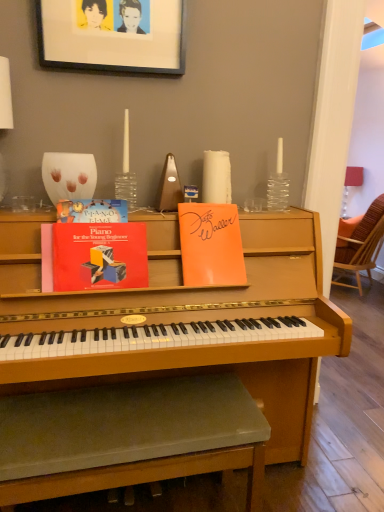
This screenshot has height=512, width=384. I want to click on orange paper at upper center, the 3th paperback book when ordered from left to right, so click(211, 245).

I want to click on matte red book at center, the 2th paperback book from the left, so click(x=99, y=256).

The image size is (384, 512). What do you see at coordinates (128, 437) in the screenshot?
I see `green fabric music stool at lower center` at bounding box center [128, 437].

Identify the location of wooden woven chair at right. The height and width of the screenshot is (512, 384). (361, 244).

What is the approximate width of black matte picture frame at upper center?

black matte picture frame at upper center is 3.58 inches wide.

The image size is (384, 512). I want to click on orange paper at upper center, the 3th paperback book when ordered from left to right, so click(211, 245).

How distant is hardcover book at upper left, acting as the 1th paperback book starting from the left, from wooden woven chair at right?

hardcover book at upper left, acting as the 1th paperback book starting from the left, and wooden woven chair at right are 10.01 feet apart from each other.

The width and height of the screenshot is (384, 512). Find the location of `paperback book above the wooden woven chair at right (from the image's perspective)`. paperback book above the wooden woven chair at right (from the image's perspective) is located at coordinates (92, 211).

Can we say hardcover book at upper left, acting as the 1th paperback book starting from the left, lies outside wooden woven chair at right?

Indeed, hardcover book at upper left, acting as the 1th paperback book starting from the left, is completely outside wooden woven chair at right.

Looking at the image, does hardcover book at upper left, which is counted as the third paperback book, starting from the right, seem bigger or smaller compared to wooden woven chair at right?

Clearly, hardcover book at upper left, which is counted as the third paperback book, starting from the right, is smaller in size than wooden woven chair at right.

From the image's perspective, is green fabric music stool at lower center below wooden woven chair at right?

Correct, green fabric music stool at lower center appears lower than wooden woven chair at right in the image.

Which object is positioned more to the right, green fabric music stool at lower center or wooden woven chair at right?

From the viewer's perspective, wooden woven chair at right appears more on the right side.

Does point (104, 421) appear closer or farther from the camera than point (370, 243)?

Point (104, 421) is closer to the camera than point (370, 243).

Is wooden woven chair at right located within green fabric music stool at lower center?

No, wooden woven chair at right is not surrounded by green fabric music stool at lower center.

Image resolution: width=384 pixels, height=512 pixels. There is a black matte picture frame at upper center. In order to click on the 3rd paperback book below it (from the image's perspective) in this screenshot , I will do (x=99, y=256).

Which is in front, point (163, 28) or point (115, 233)?

The point (115, 233) is closer.

Is black matte picture frame at upper center shorter than matte red book at center, arranged as the 2th paperback book when viewed from the right?

No, black matte picture frame at upper center is not shorter than matte red book at center, arranged as the 2th paperback book when viewed from the right.

Considering the sizes of black matte picture frame at upper center and matte red book at center, the 2th paperback book from the left, in the image, is black matte picture frame at upper center wider or thinner than matte red book at center, the 2th paperback book from the left,?

Considering their sizes, black matte picture frame at upper center looks slimmer than matte red book at center, the 2th paperback book from the left.

Consider the image. Is green fabric music stool at lower center a part of hardcover book at upper left, which is counted as the third paperback book, starting from the right?

No, green fabric music stool at lower center is not inside hardcover book at upper left, which is counted as the third paperback book, starting from the right.

Between hardcover book at upper left, which is counted as the third paperback book, starting from the right, and green fabric music stool at lower center, which one has more height?

green fabric music stool at lower center.

Considering the relative positions of hardcover book at upper left, acting as the 1th paperback book starting from the left, and green fabric music stool at lower center in the image provided, is hardcover book at upper left, acting as the 1th paperback book starting from the left, behind green fabric music stool at lower center?

Yes, hardcover book at upper left, acting as the 1th paperback book starting from the left, is further from the camera.

Locate an element on the screen. The width and height of the screenshot is (384, 512). music stool below the hardcover book at upper left, which is counted as the third paperback book, starting from the right (from a real-world perspective) is located at coordinates (128, 437).

Between orange paper at upper center, the 3th paperback book when ordered from left to right, and green fabric music stool at lower center, which one has smaller size?

orange paper at upper center, the 3th paperback book when ordered from left to right.

Is orange paper at upper center, the first paperback book when ordered from right to left, located outside green fabric music stool at lower center?

Yes, orange paper at upper center, the first paperback book when ordered from right to left, is located beyond the bounds of green fabric music stool at lower center.

From the image's perspective, which is below, orange paper at upper center, the first paperback book when ordered from right to left, or green fabric music stool at lower center?

green fabric music stool at lower center is shown below in the image.

Is orange paper at upper center, the first paperback book when ordered from right to left, facing towards green fabric music stool at lower center?

No, orange paper at upper center, the first paperback book when ordered from right to left, is not oriented towards green fabric music stool at lower center.

Which object is thinner, orange paper at upper center, the 3th paperback book when ordered from left to right, or matte red book at center, arranged as the 2th paperback book when viewed from the right?

matte red book at center, arranged as the 2th paperback book when viewed from the right, is thinner.

From a real-world perspective, is orange paper at upper center, the first paperback book when ordered from right to left, positioned under matte red book at center, the 2th paperback book from the left, based on gravity?

Actually, orange paper at upper center, the first paperback book when ordered from right to left, is physically above matte red book at center, the 2th paperback book from the left, in the real world.

Can you confirm if orange paper at upper center, the 3th paperback book when ordered from left to right, is bigger than matte red book at center, arranged as the 2th paperback book when viewed from the right?

Correct, orange paper at upper center, the 3th paperback book when ordered from left to right, is larger in size than matte red book at center, arranged as the 2th paperback book when viewed from the right.

Does orange paper at upper center, the 3th paperback book when ordered from left to right, lie in front of matte red book at center, arranged as the 2th paperback book when viewed from the right?

No, orange paper at upper center, the 3th paperback book when ordered from left to right, is further to the viewer.

From a real-world perspective, relative to wooden woven chair at right, is black matte picture frame at upper center vertically above or below?

From a real-world perspective, black matte picture frame at upper center is physically above wooden woven chair at right.

Does black matte picture frame at upper center have a greater height compared to wooden woven chair at right?

No.

From the image's perspective, is black matte picture frame at upper center above or below wooden woven chair at right?

black matte picture frame at upper center is situated higher than wooden woven chair at right in the image.

Which of these two, black matte picture frame at upper center or wooden woven chair at right, is thinner?

Thinner between the two is black matte picture frame at upper center.

You are a GUI agent. You are given a task and a screenshot of the screen. Output one action in this format:
    pyautogui.click(x=<x>, y=<y>)
    Task: Click on the paperback book located above the wooden woven chair at right (from the image's perspective)
    
    Given the screenshot: What is the action you would take?
    pyautogui.click(x=92, y=211)

Identify the location of music stool in front of the wooden woven chair at right. This screenshot has width=384, height=512. (128, 437).

Estimate the real-world distances between objects in this image. Which object is further from hardcover book at upper left, which is counted as the third paperback book, starting from the right, green fabric music stool at lower center or orange paper at upper center, the first paperback book when ordered from right to left?

The object further to hardcover book at upper left, which is counted as the third paperback book, starting from the right, is green fabric music stool at lower center.

Based on their spatial positions, is matte red book at center, the 2th paperback book from the left, or black matte picture frame at upper center further from orange paper at upper center, the first paperback book when ordered from right to left?

black matte picture frame at upper center lies further to orange paper at upper center, the first paperback book when ordered from right to left, than the other object.

Based on their spatial positions, is orange paper at upper center, the 3th paperback book when ordered from left to right, or hardcover book at upper left, which is counted as the third paperback book, starting from the right, further from wooden woven chair at right?

hardcover book at upper left, which is counted as the third paperback book, starting from the right, is positioned further to the anchor wooden woven chair at right.

Estimate the real-world distances between objects in this image. Which object is closer to wooden woven chair at right, matte red book at center, arranged as the 2th paperback book when viewed from the right, or hardcover book at upper left, acting as the 1th paperback book starting from the left?

Among the two, matte red book at center, arranged as the 2th paperback book when viewed from the right, is located nearer to wooden woven chair at right.

Looking at the image, which one is located closer to orange paper at upper center, the 3th paperback book when ordered from left to right, hardcover book at upper left, which is counted as the third paperback book, starting from the right, or wooden woven chair at right?

hardcover book at upper left, which is counted as the third paperback book, starting from the right, is closer to orange paper at upper center, the 3th paperback book when ordered from left to right.

Considering their positions, is green fabric music stool at lower center positioned further to black matte picture frame at upper center than wooden woven chair at right?

Among the two, wooden woven chair at right is located further to black matte picture frame at upper center.

Estimate the real-world distances between objects in this image. Which object is closer to green fabric music stool at lower center, matte red book at center, arranged as the 2th paperback book when viewed from the right, or orange paper at upper center, the 3th paperback book when ordered from left to right?

The object closer to green fabric music stool at lower center is matte red book at center, arranged as the 2th paperback book when viewed from the right.

From the picture: Estimate the real-world distances between objects in this image. Which object is further from matte red book at center, the 2th paperback book from the left, black matte picture frame at upper center or hardcover book at upper left, acting as the 1th paperback book starting from the left?

black matte picture frame at upper center lies further to matte red book at center, the 2th paperback book from the left, than the other object.

Identify the location of picture frame located between green fabric music stool at lower center and wooden woven chair at right in the depth direction. (112, 35).

What are the coordinates of `paperback book that lies between orange paper at upper center, the first paperback book when ordered from right to left, and green fabric music stool at lower center from top to bottom` in the screenshot? It's located at (99, 256).

Identify the location of picture frame between hardcover book at upper left, which is counted as the third paperback book, starting from the right, and wooden woven chair at right, along the z-axis. Image resolution: width=384 pixels, height=512 pixels. [112, 35].

At what (x,y) coordinates should I click in order to perform the action: click on picture frame between orange paper at upper center, the first paperback book when ordered from right to left, and wooden woven chair at right, along the z-axis. Please return your answer as a coordinate pair (x, y). This screenshot has height=512, width=384. Looking at the image, I should click on (112, 35).